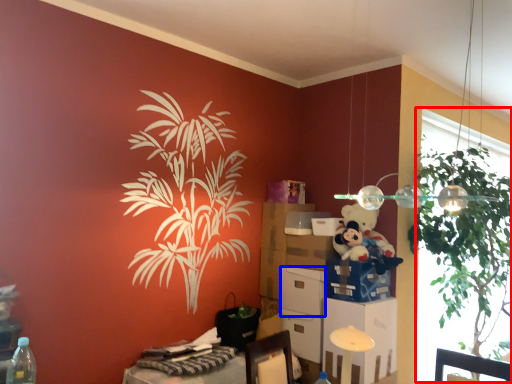
Question: Which object is further to the camera taking this photo, window screen (highlighted by a red box) or box (highlighted by a blue box)?

Choices:
 (A) window screen
 (B) box

Answer: (B)